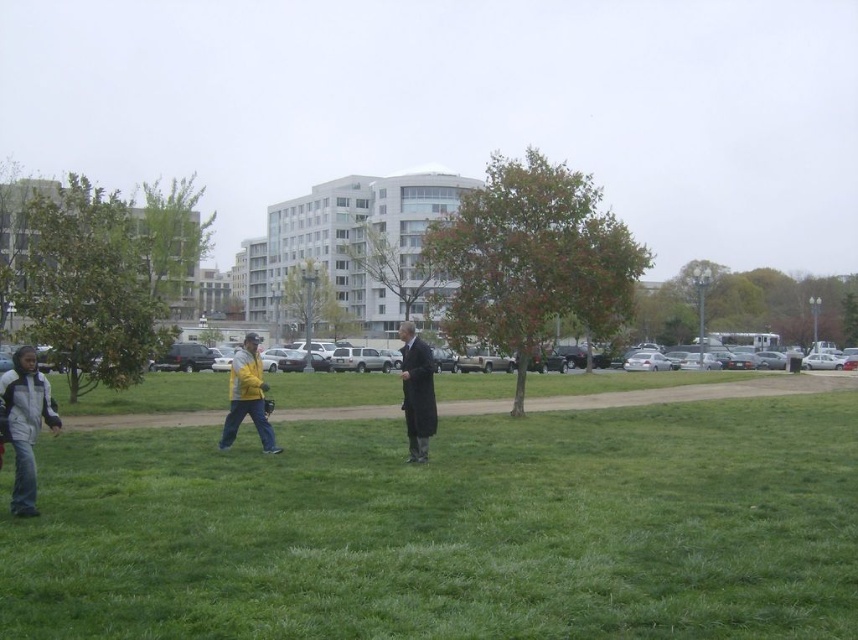
Question: Does green grass at center appear over yellow jacket at center?

Choices:
 (A) no
 (B) yes

Answer: (A)

Question: Which of these objects is positioned closest to the dark gray wool coat at center?

Choices:
 (A) yellow jacket at center
 (B) gray/white jacket at lower left

Answer: (A)

Question: Which object appears farthest from the camera in this image?

Choices:
 (A) dark gray wool coat at center
 (B) yellow jacket at center
 (C) green grass at center
 (D) gray/white jacket at lower left

Answer: (B)

Question: Which object is positioned farthest from the green grass at center?

Choices:
 (A) dark gray wool coat at center
 (B) gray/white jacket at lower left

Answer: (B)

Question: Is dark gray wool coat at center to the right of yellow jacket at center from the viewer's perspective?

Choices:
 (A) yes
 (B) no

Answer: (A)

Question: In this image, where is dark gray wool coat at center located relative to yellow jacket at center?

Choices:
 (A) above
 (B) below

Answer: (A)